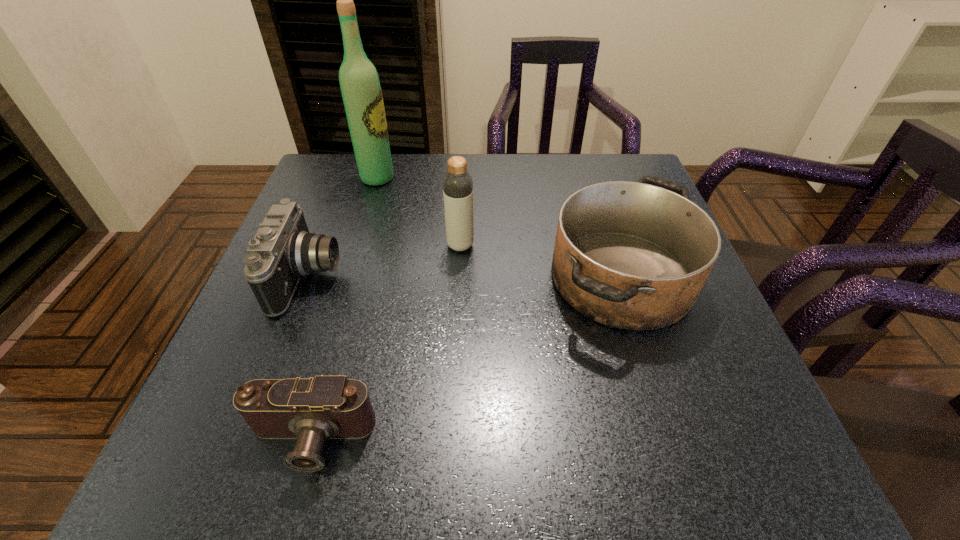
You are a GUI agent. You are given a task and a screenshot of the screen. Output one action in this format:
    pyautogui.click(x=<x>, y=<y>)
    Task: Click on the vacant region between the rightmost object and the taller camera
    The width and height of the screenshot is (960, 540).
    Given the screenshot: What is the action you would take?
    pyautogui.click(x=466, y=277)

Identify the location of vacant space that is in between the farther camera and the wine bottle. This screenshot has width=960, height=540. (344, 227).

Identify the location of vacant space that is in between the shortest object and the farthest object. The width and height of the screenshot is (960, 540). (344, 309).

Image resolution: width=960 pixels, height=540 pixels. Find the location of `object that stands as the third closest to the fourth shortest object`. object that stands as the third closest to the fourth shortest object is located at coordinates (361, 90).

Locate an element on the screen. The height and width of the screenshot is (540, 960). object that stands as the second closest to the saucepan is located at coordinates (313, 410).

Where is `free space that satisfies the following two spatial constraints: 1. on the front side of the fourth shortest object; 2. on the front-facing side of the farther camera`? The height and width of the screenshot is (540, 960). free space that satisfies the following two spatial constraints: 1. on the front side of the fourth shortest object; 2. on the front-facing side of the farther camera is located at coordinates (459, 277).

What are the coordinates of `vacant space that satisfies the following two spatial constraints: 1. on the back side of the saucepan; 2. on the front-facing side of the wine bottle` in the screenshot? It's located at (589, 178).

In order to click on vacant space that satisfies the following two spatial constraints: 1. on the front-facing side of the second tallest object; 2. on the left side of the tallest object in this screenshot , I will do `click(357, 245)`.